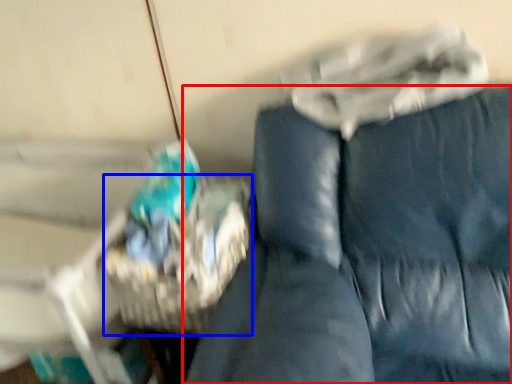
Question: Which point is further to the camera, furniture (highlighted by a red box) or basket (highlighted by a blue box)?

Choices:
 (A) furniture
 (B) basket

Answer: (B)